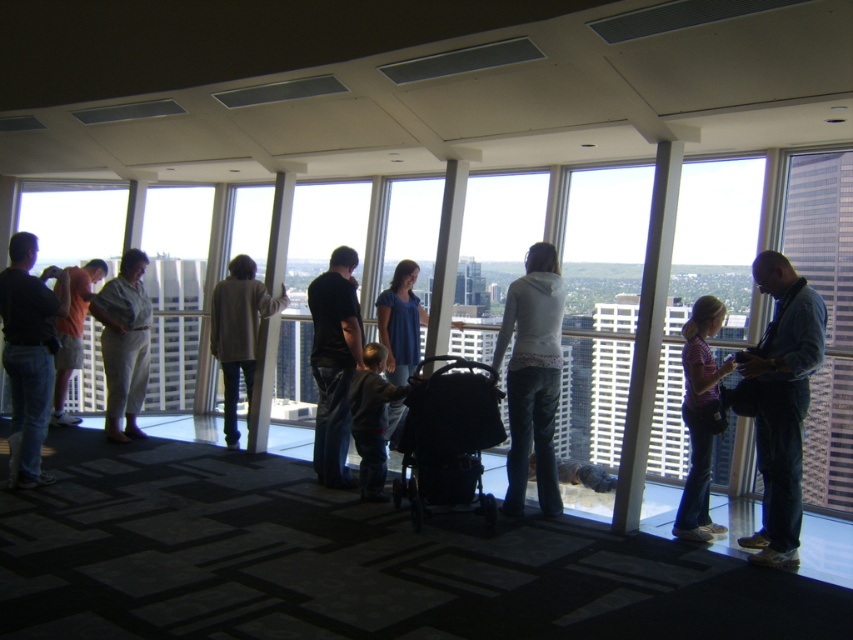
What do you see at coordinates (532, 376) in the screenshot?
I see `white fleece hoodie at center` at bounding box center [532, 376].

Find the location of `white fleece hoodie at center`. white fleece hoodie at center is located at coordinates pyautogui.click(x=532, y=376).

At what (x,y) coordinates should I click in order to perform the action: click on white fleece hoodie at center. Please return your answer as a coordinate pair (x, y). This screenshot has height=640, width=853. Looking at the image, I should click on pyautogui.click(x=532, y=376).

Is dark blue jeans at left shorter than purple cotton shirt at center?

No.

Is point (33, 253) in front of point (709, 536)?

No.

Which is in front, point (25, 452) or point (717, 378)?

Positioned in front is point (717, 378).

Where is `dark blue jeans at left`? dark blue jeans at left is located at coordinates (28, 353).

Is point (463, 433) positioned before point (375, 484)?

That is True.

Between point (469, 508) and point (379, 371), which one is positioned behind?

Point (379, 371)

Measure the distance between black matte baby carriage at center and camera.

They are 15.49 feet apart.

In order to click on black matte baby carriage at center in this screenshot , I will do `click(448, 440)`.